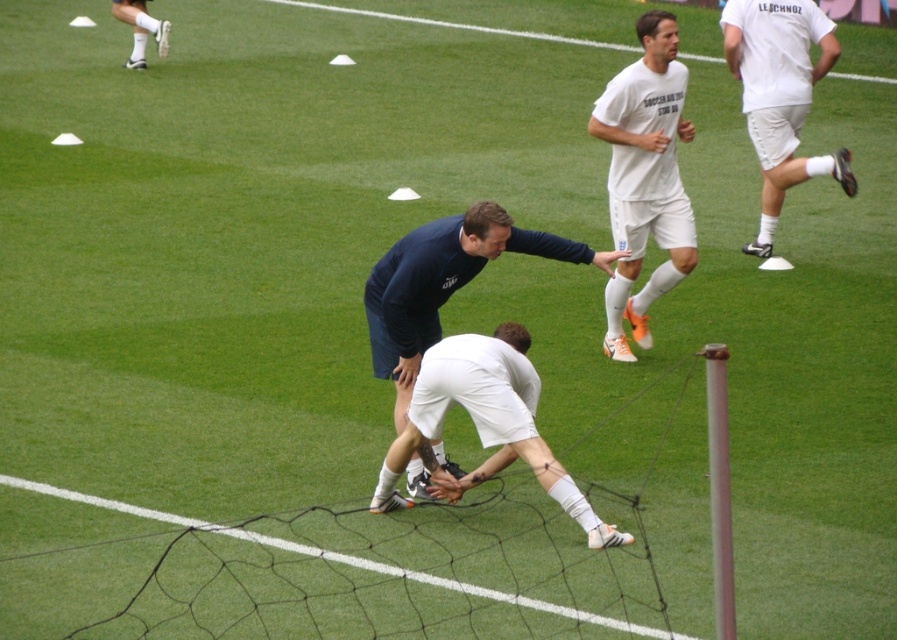
Based on the scene description, can you determine which object, the white matte shorts at center or the dark blue fabric shirt at center, is smaller in size?

The white matte shorts at center has a smaller size compared to the dark blue fabric shirt at center.

In the soccer training scene, you see the white matte shorts at right and the dark blue fabric shirt at center. Which object is positioned more to the east?

The white matte shorts at right is positioned to the right of the dark blue fabric shirt at center, so it is more to the east.

You are a soccer coach observing the training session. You notice the white matte shorts at right and the dark blue fabric shirt at center. Which piece of clothing is larger in size?

The dark blue fabric shirt at center is larger than the white matte shorts at right.